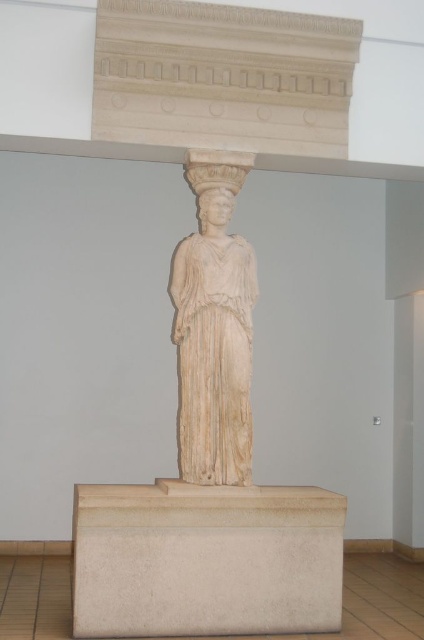
You are a visitor in the museum and want to take a photo of the white marble statue at center. However, there is a white marble pedestal at center blocking your view. Can you move around to the side to get a clear shot without the pedestal blocking the statue?

The white marble pedestal at center is closer to the viewer than the white marble statue at center. Moving to the side may allow you to see around the pedestal to capture the statue without obstruction.

You are an art conservator examining the classical marble statue of a female figure in the museum. You notice a point at coordinates (206, 560). Based on the scene, where is this point located?

The point at coordinates (206, 560) is on the white marble pedestal at center.

You are a tour guide explaining the statue to visitors. You point to two specific points on the statue. The first point is at coordinate (x=264, y=573) and the second is at (x=187, y=250). Which of these two points is closer to the front of the statue?

Point (x=264, y=573) is in front of point (x=187, y=250), so the first point is closer to the front of the statue.